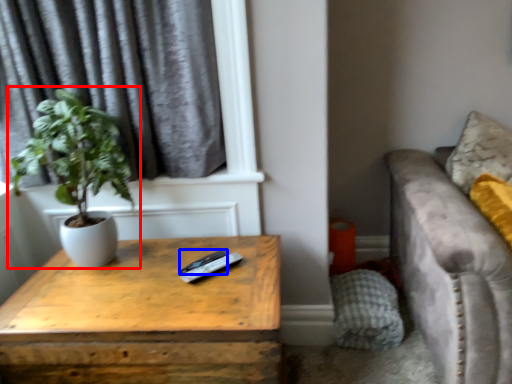
Question: Which object appears closest to the camera in this image, houseplant (highlighted by a red box) or remote (highlighted by a blue box)?

Choices:
 (A) houseplant
 (B) remote

Answer: (A)